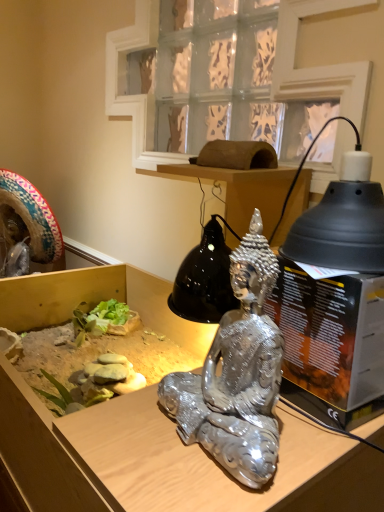
Identify the location of blank area to the left of shiny silver statue at center. Image resolution: width=384 pixels, height=512 pixels. tap(107, 442).